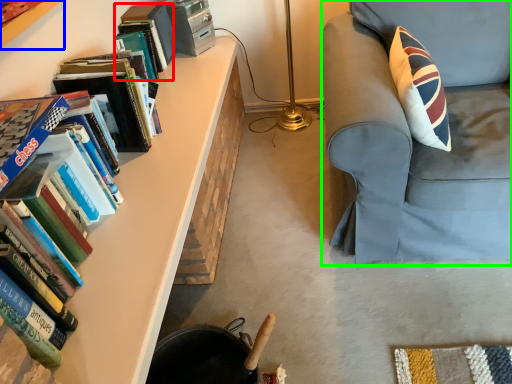
Question: Estimate the real-world distances between objects in this image. Which object is farther from book (highlighted by a red box), bookcase (highlighted by a blue box) or chair (highlighted by a green box)?

Choices:
 (A) bookcase
 (B) chair

Answer: (B)